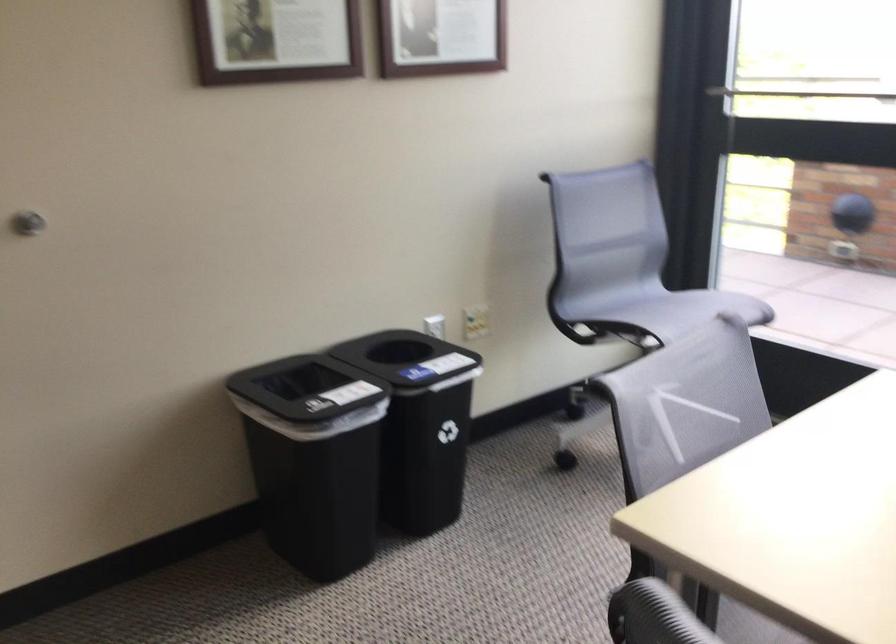
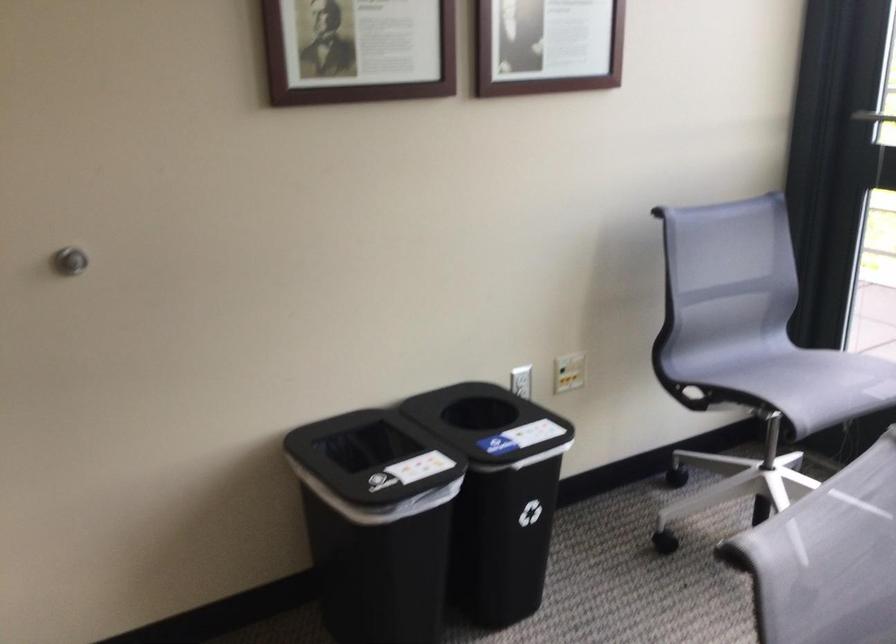
Find the pixel in the second image that matches [319,439] in the first image.

(376, 522)